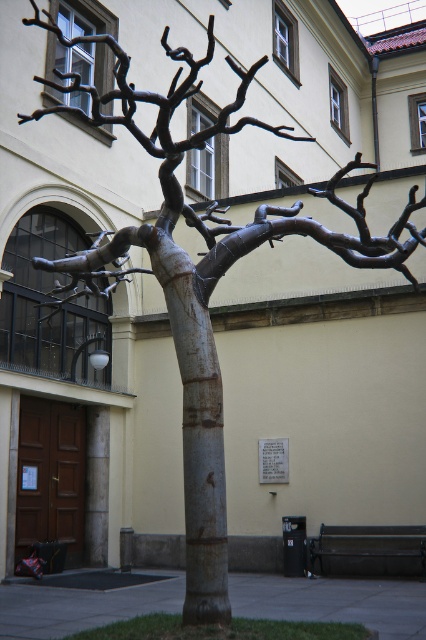
Question: Which point is closer to the camera?

Choices:
 (A) polished bronze branch at center
 (B) rustic wood tree trunk at center

Answer: (B)

Question: Which of the following is the closest to the observer?

Choices:
 (A) (222, 552)
 (B) (420, 237)

Answer: (A)

Question: Does rustic wood tree trunk at center have a larger size compared to polished bronze branch at center?

Choices:
 (A) yes
 (B) no

Answer: (B)

Question: From the image, what is the correct spatial relationship of rustic wood tree trunk at center in relation to polished bronze branch at center?

Choices:
 (A) right
 (B) left

Answer: (B)

Question: From the image, what is the correct spatial relationship of rustic wood tree trunk at center in relation to polished bronze branch at center?

Choices:
 (A) above
 (B) below

Answer: (B)